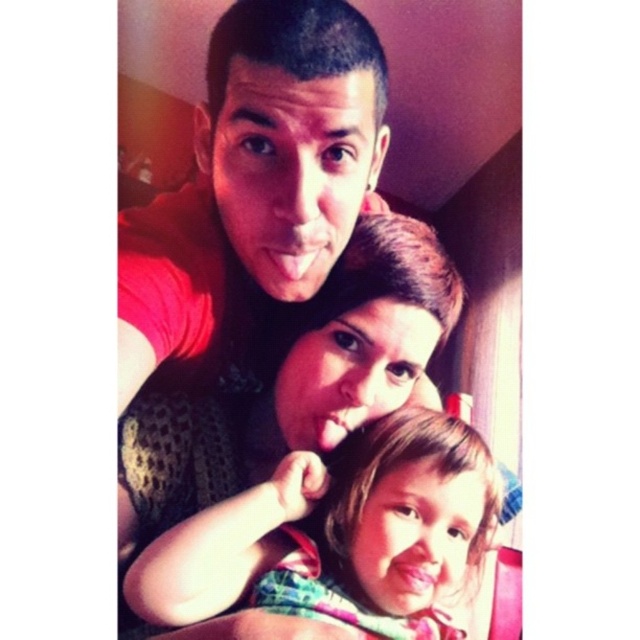
You are taking a photo of a family and need to ensure that both the multicolored fabric dress at center and the matte black shirt at center are visible. Which object should be positioned to the right to maintain their visibility?

The multicolored fabric dress at center should be positioned to the right of the matte black shirt at center to ensure both are visible.